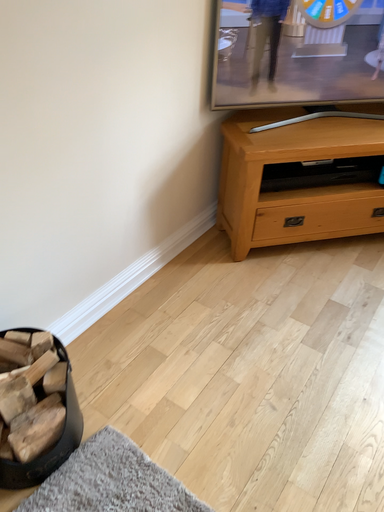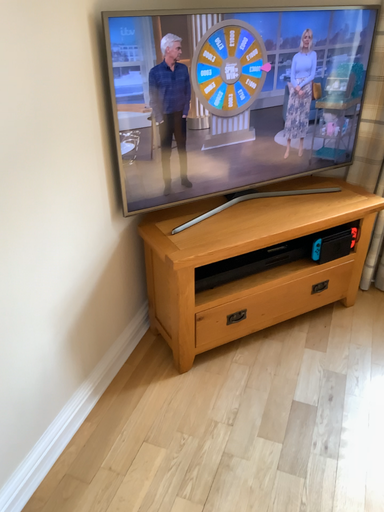
Question: How did the camera likely rotate when shooting the video?

Choices:
 (A) rotated left
 (B) rotated right

Answer: (B)